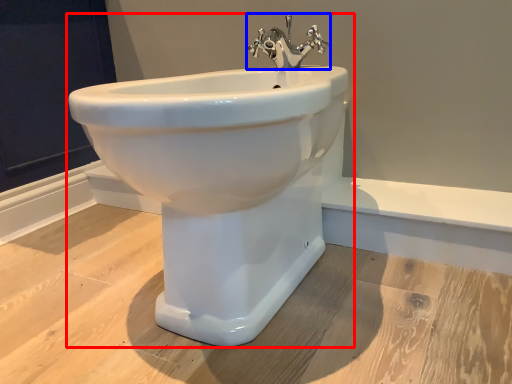
Question: Which object appears closest to the camera in this image, sink (highlighted by a red box) or tap (highlighted by a blue box)?

Choices:
 (A) sink
 (B) tap

Answer: (A)